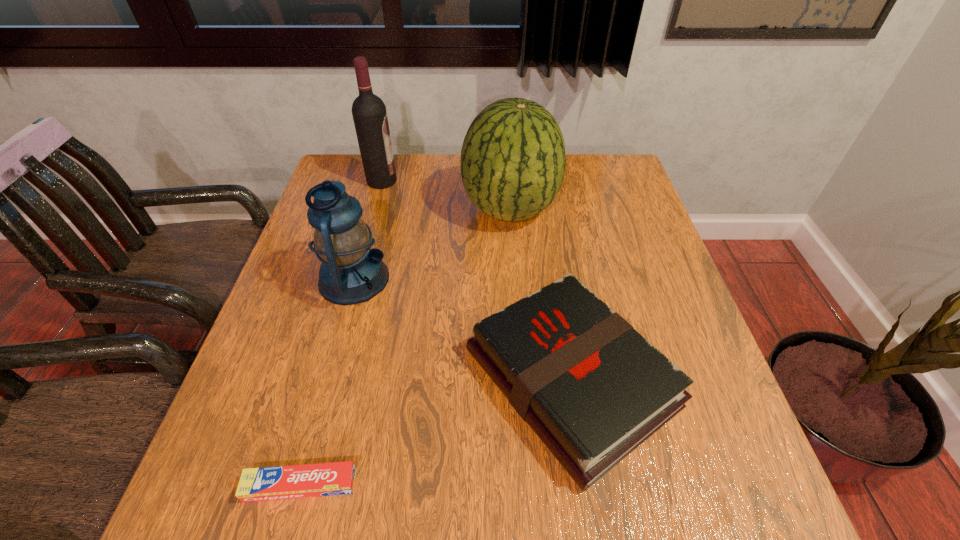
Find the location of a particular element. The height and width of the screenshot is (540, 960). wine bottle is located at coordinates (x=369, y=113).

I want to click on watermelon, so 513,159.

Locate an element on the screen. The width and height of the screenshot is (960, 540). lantern is located at coordinates (351, 272).

Find the location of a particular element. the fourth tallest object is located at coordinates (593, 389).

At what (x,y) coordinates should I click in order to perform the action: click on the shortest object. Please return your answer as a coordinate pair (x, y). Image resolution: width=960 pixels, height=540 pixels. Looking at the image, I should click on (336, 478).

Find the location of a particular element. The image size is (960, 540). free space located on the label of the wine bottle is located at coordinates (443, 181).

Where is `vacant space located on the left of the watermelon`? The image size is (960, 540). vacant space located on the left of the watermelon is located at coordinates (373, 210).

You are a GUI agent. You are given a task and a screenshot of the screen. Output one action in this format:
    pyautogui.click(x=<x>, y=<y>)
    Task: Click on the free space located 0.060m on the face of the lantern
    This screenshot has width=960, height=540.
    Given the screenshot: What is the action you would take?
    pyautogui.click(x=414, y=279)

I want to click on free spot located 0.160m on the back of the hardback book, so click(x=549, y=250).

Find the location of a particular element. The width and height of the screenshot is (960, 540). vacant space located on the back of the shortest object is located at coordinates (335, 359).